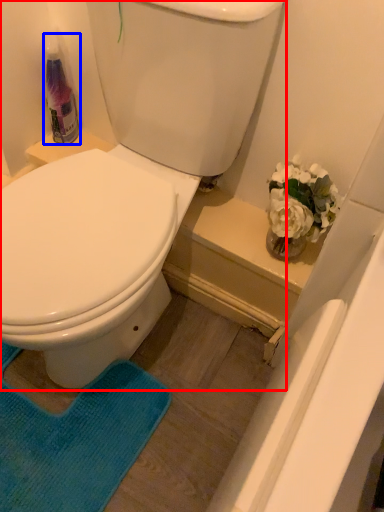
Question: Which object appears closest to the camera in this image, toilet (highlighted by a red box) or cleaning product (highlighted by a blue box)?

Choices:
 (A) toilet
 (B) cleaning product

Answer: (A)